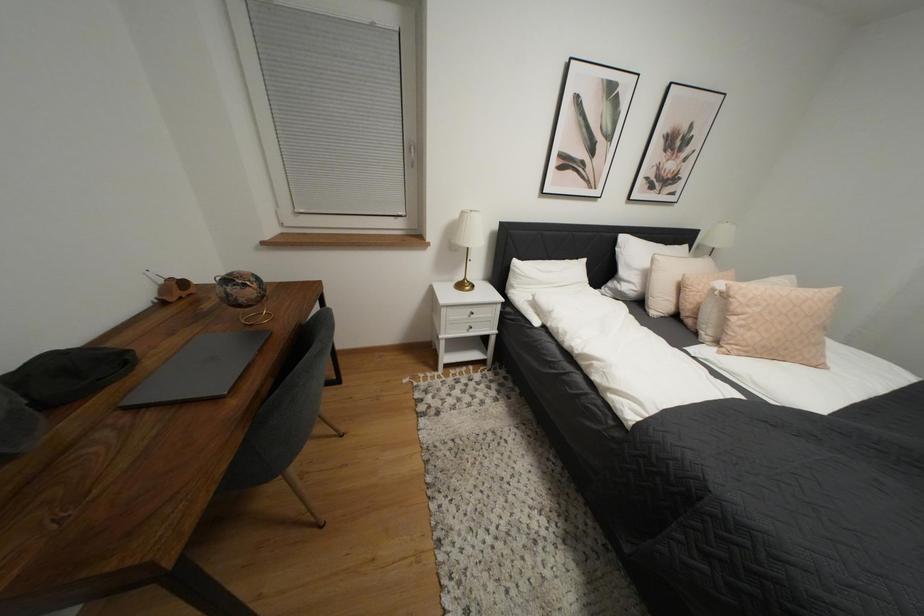
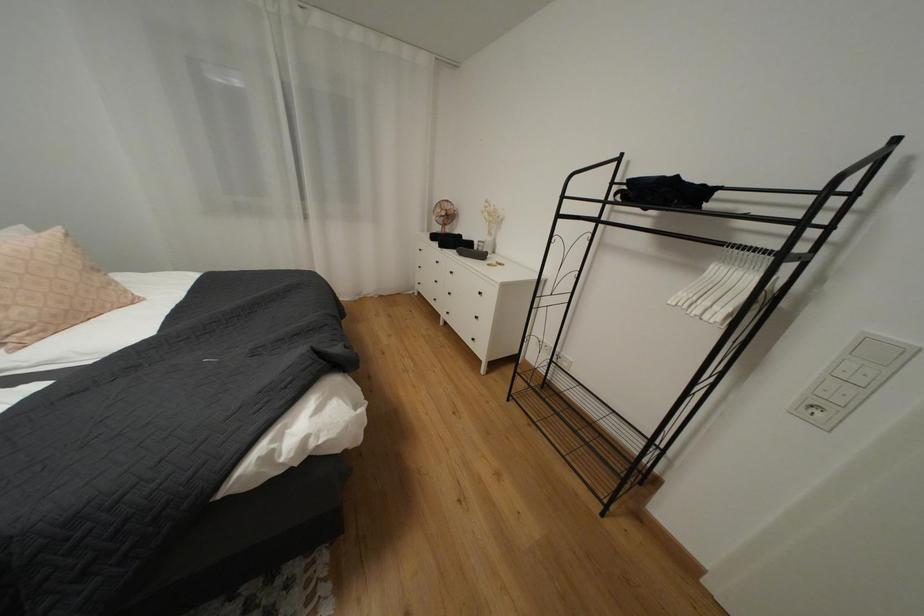
First-person continuous shooting, in which direction is the camera rotating?

The rotation direction of the camera is right-down.